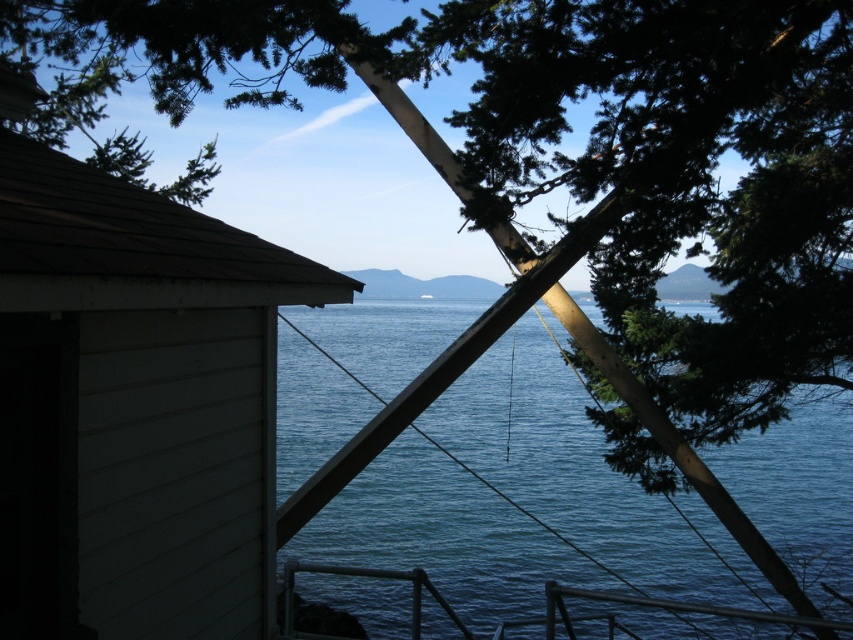
Which is more to the left, white wood hut at left or blue water at center?

Positioned to the left is white wood hut at left.

Who is lower down, white wood hut at left or blue water at center?

Positioned lower is blue water at center.

The height and width of the screenshot is (640, 853). What do you see at coordinates (135, 406) in the screenshot?
I see `white wood hut at left` at bounding box center [135, 406].

At what (x,y) coordinates should I click in order to perform the action: click on white wood hut at left. Please return your answer as a coordinate pair (x, y). The image size is (853, 640). Looking at the image, I should click on (135, 406).